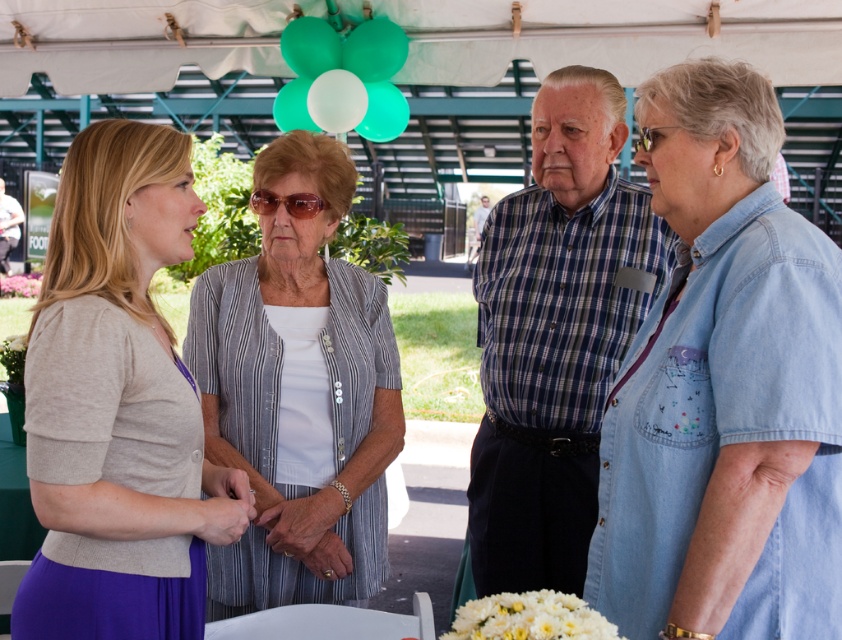
You are organizing a photo shoot and need to arrange two models wearing the striped fabric blouse at center and the matte blue shirt at center side by side. Based on their current positions in the image, which model should stand on the left to ensure they have enough space between them?

The striped fabric blouse at center is wider than the matte blue shirt at center, so the model wearing the striped fabric blouse at center should stand on the left to allow more space between them.

You are taking a photo of the scene and want to focus on both point (59, 396) and point (1, 189). Which point should you adjust your focus first to ensure both are in focus?

Since point (59, 396) is closer to the camera than point (1, 189), you should focus on point (59, 396) first to ensure both are in focus.

You are a photographer at this event and need to adjust the camera focus. The striped fabric blouse at center and the matte blue shirt at center are both in the frame. Which one should you focus on first if you want to capture the person wearing the shorter top?

The striped fabric blouse at center is shorter than the matte blue shirt at center, so you should focus on the striped fabric blouse at center first to capture the person wearing the shorter top.